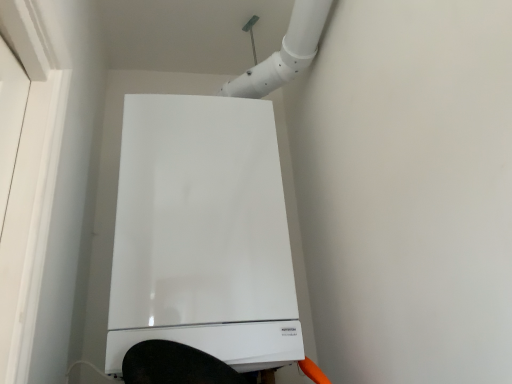
Where is `white glossy boiler at center`? The height and width of the screenshot is (384, 512). white glossy boiler at center is located at coordinates (202, 233).

What do you see at coordinates (202, 233) in the screenshot? This screenshot has height=384, width=512. I see `white glossy boiler at center` at bounding box center [202, 233].

I want to click on white glossy boiler at center, so click(202, 233).